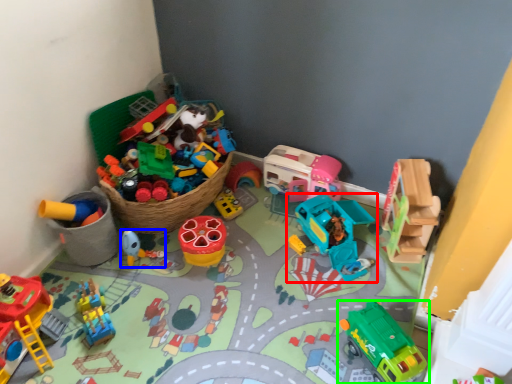
Question: Which object is the closest to the toy (highlighted by a red box)? Choose among these: toy (highlighted by a blue box) or toy (highlighted by a green box).

Choices:
 (A) toy
 (B) toy

Answer: (B)